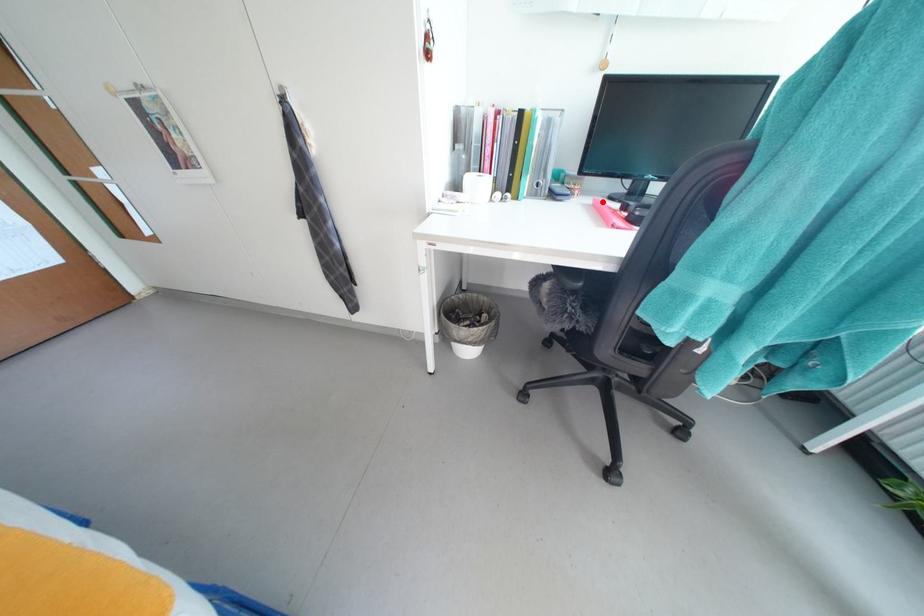
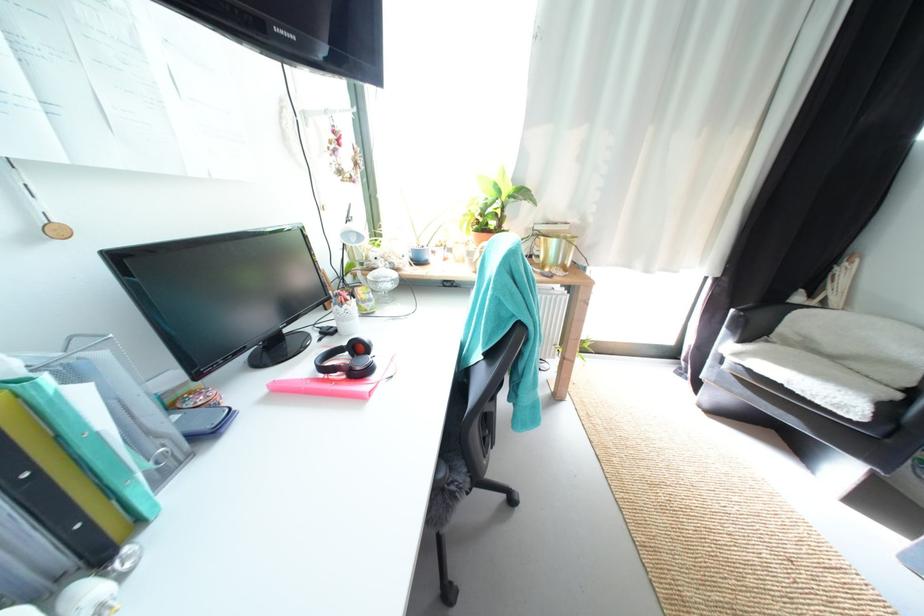
Question: I am providing you with two images of the same scene from different viewpoints. A red point is marked on the first image. Is the red point's position out of view in image 2?

Choices:
 (A) Yes
 (B) No

Answer: (B)